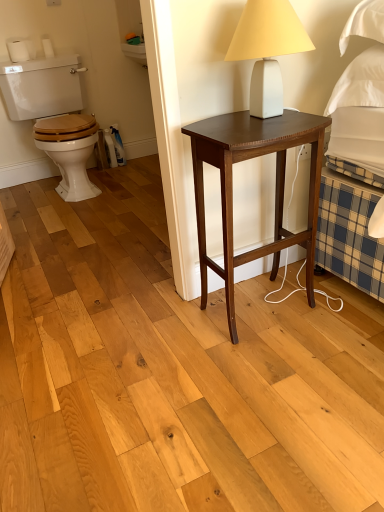
You are a GUI agent. You are given a task and a screenshot of the screen. Output one action in this format:
    pyautogui.click(x=<x>, y=<y>)
    Task: Click on the free space below dark wood nightstand at center (from a real-world perspective)
    The image size is (384, 512).
    Given the screenshot: What is the action you would take?
    pyautogui.click(x=266, y=307)